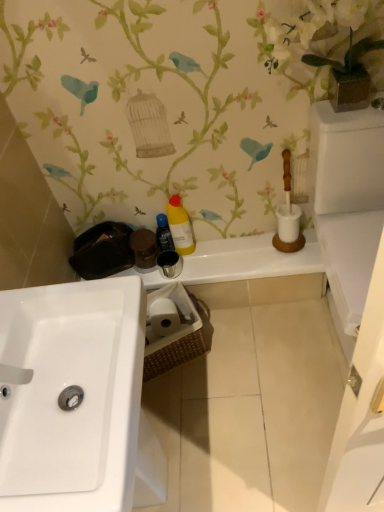
Question: Is matte black toiletries at center outside of white glossy sink at lower left?

Choices:
 (A) yes
 (B) no

Answer: (A)

Question: Is matte black toiletries at center surrounding white glossy sink at lower left?

Choices:
 (A) no
 (B) yes

Answer: (A)

Question: Does matte black toiletries at center appear on the left side of white glossy sink at lower left?

Choices:
 (A) no
 (B) yes

Answer: (A)

Question: Considering the relative sizes of matte black toiletries at center and white glossy sink at lower left in the image provided, is matte black toiletries at center shorter than white glossy sink at lower left?

Choices:
 (A) no
 (B) yes

Answer: (B)

Question: Considering the relative sizes of matte black toiletries at center and white glossy sink at lower left in the image provided, is matte black toiletries at center smaller than white glossy sink at lower left?

Choices:
 (A) yes
 (B) no

Answer: (A)

Question: Is matte black toiletries at center inside the boundaries of yellow matte bottle at center, the second cleaning product positioned from the right, or outside?

Choices:
 (A) outside
 (B) inside

Answer: (A)

Question: Looking at their shapes, would you say matte black toiletries at center is wider or thinner than yellow matte bottle at center, the second cleaning product positioned from the right?

Choices:
 (A) thin
 (B) wide

Answer: (B)

Question: In the image, is matte black toiletries at center positioned in front of or behind yellow matte bottle at center, arranged as the 1th cleaning product when viewed from the left?

Choices:
 (A) behind
 (B) front

Answer: (B)

Question: Is point (200, 279) closer or farther from the camera than point (172, 240)?

Choices:
 (A) farther
 (B) closer

Answer: (B)

Question: Is white glossy sink at lower left inside or outside of white matte vase at upper right?

Choices:
 (A) inside
 (B) outside

Answer: (B)

Question: Considering the positions of white glossy sink at lower left and white matte vase at upper right in the image, is white glossy sink at lower left bigger or smaller than white matte vase at upper right?

Choices:
 (A) small
 (B) big

Answer: (B)

Question: Considering the positions of white glossy sink at lower left and white matte vase at upper right in the image, is white glossy sink at lower left wider or thinner than white matte vase at upper right?

Choices:
 (A) thin
 (B) wide

Answer: (B)

Question: From the image's perspective, is white glossy sink at lower left positioned above or below white matte vase at upper right?

Choices:
 (A) above
 (B) below

Answer: (B)

Question: Considering the relative positions of yellow matte bottle at center, the 1th cleaning product when ordered from right to left, and matte black toiletries at center in the image provided, is yellow matte bottle at center, the 1th cleaning product when ordered from right to left, to the left or to the right of matte black toiletries at center?

Choices:
 (A) left
 (B) right

Answer: (A)

Question: Does point (173, 200) appear closer or farther from the camera than point (294, 256)?

Choices:
 (A) closer
 (B) farther

Answer: (A)